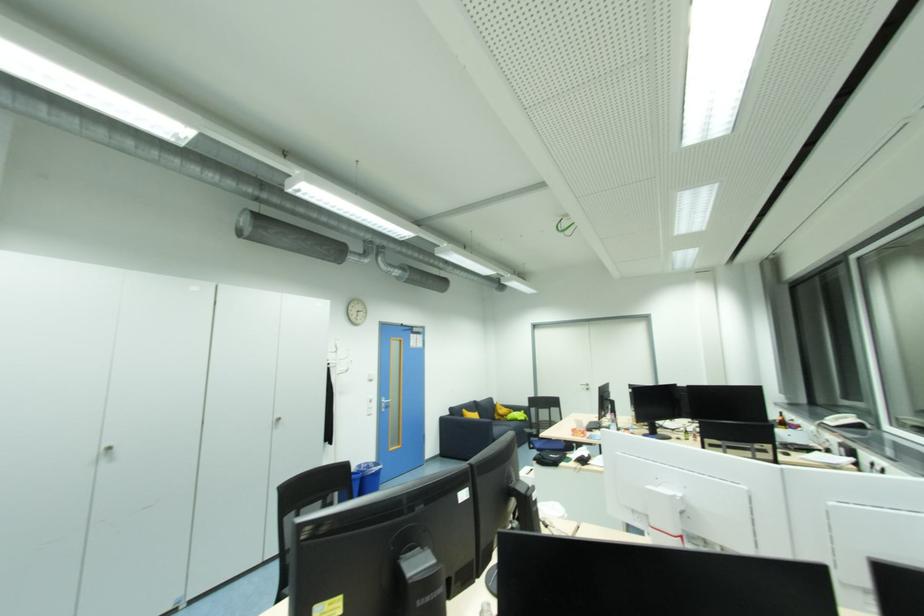
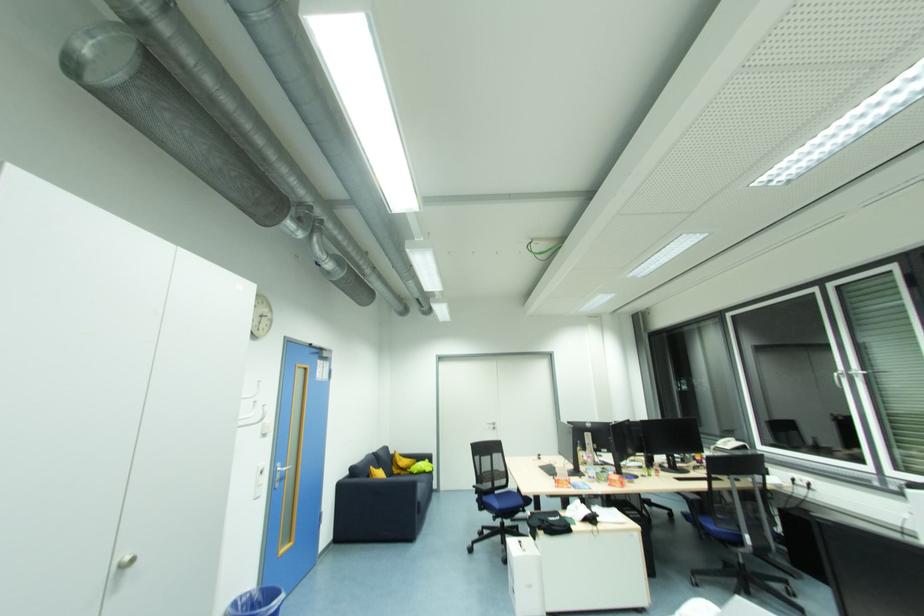
The point at (466, 416) is marked in the first image. Where is the corresponding point in the second image?

(371, 477)